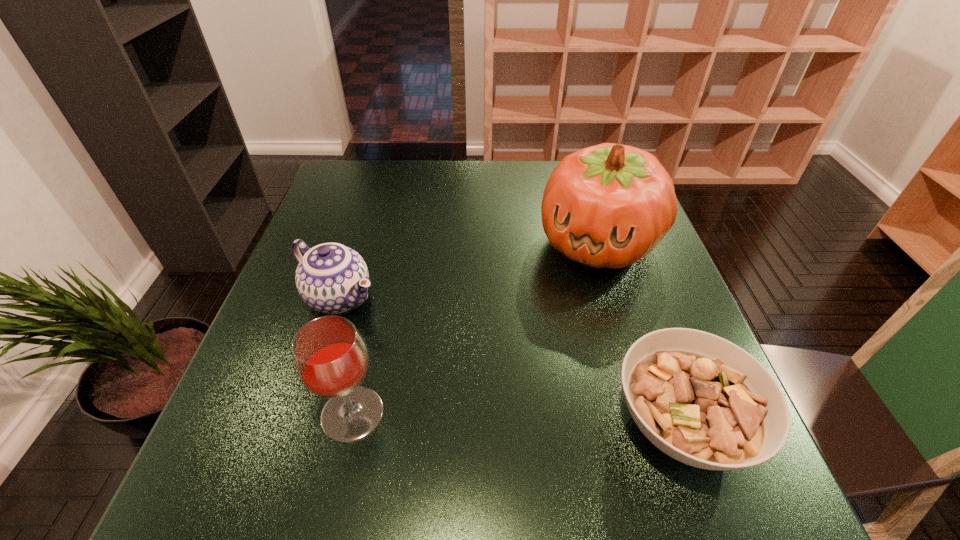
The width and height of the screenshot is (960, 540). I want to click on vacant area that lies between the chinaware and the stew, so click(510, 360).

This screenshot has height=540, width=960. Identify the location of object that stands as the second closest to the stew. (330, 358).

Select which object is the third closest to the second tallest object. Please provide its 2D coordinates. Your answer should be formatted as a tuple, i.e. [(x, y)], where the tuple contains the x and y coordinates of a point satisfying the conditions above.

[(609, 205)]

Find the location of `vacant region that satisfies the following two spatial constraints: 1. on the back side of the chinaware; 2. on the left side of the tallest object`. vacant region that satisfies the following two spatial constraints: 1. on the back side of the chinaware; 2. on the left side of the tallest object is located at coordinates (356, 243).

Locate an element on the screen. blank area in the image that satisfies the following two spatial constraints: 1. on the front side of the third shortest object; 2. on the right side of the shortest object is located at coordinates (350, 423).